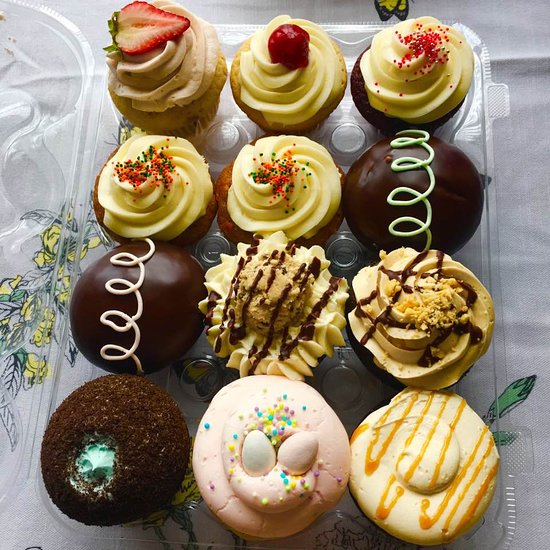
Find the location of a particular element. The image size is (550, 550). clear plastic container is located at coordinates (524, 461).